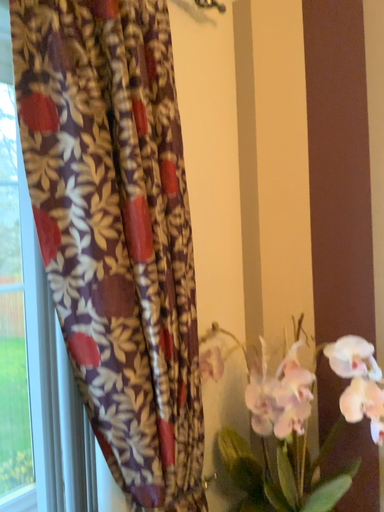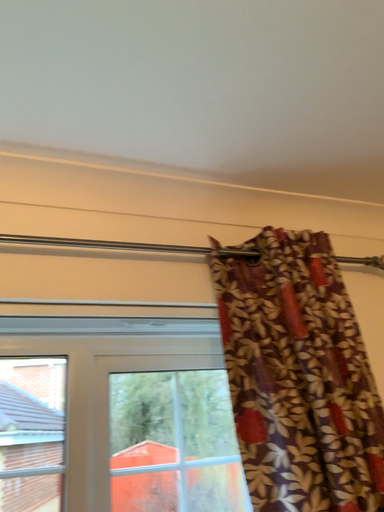
Question: How did the camera likely rotate when shooting the video?

Choices:
 (A) rotated left
 (B) rotated right

Answer: (A)